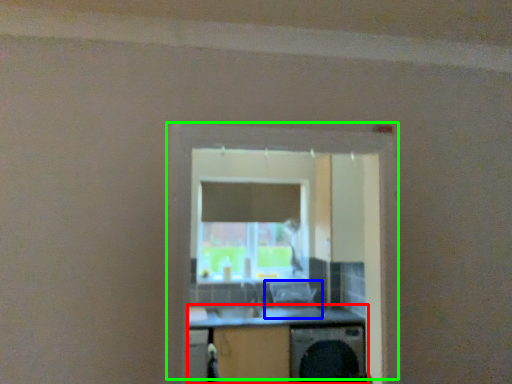
Question: Considering the real-world distances, which object is farthest from computer desk (highlighted by a red box)? computer chair (highlighted by a blue box) or window (highlighted by a green box)?

Choices:
 (A) computer chair
 (B) window

Answer: (B)